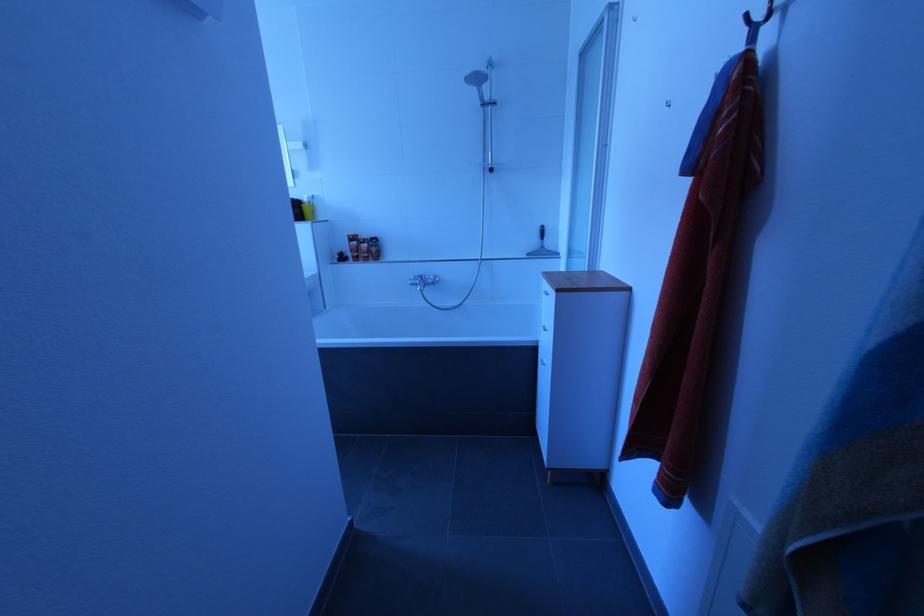
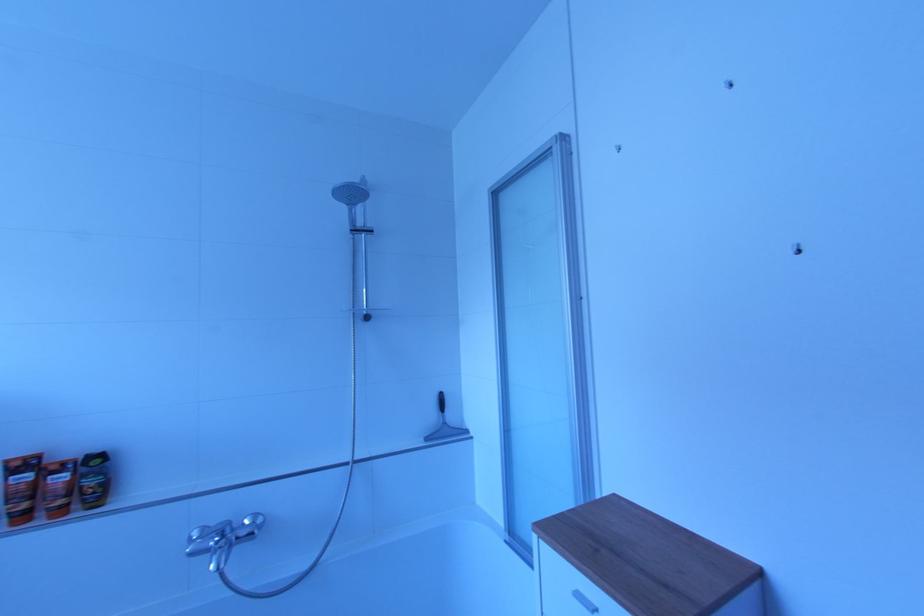
First-person continuous shooting, in which direction is the camera rotating?

The rotation direction of the camera is right-up.